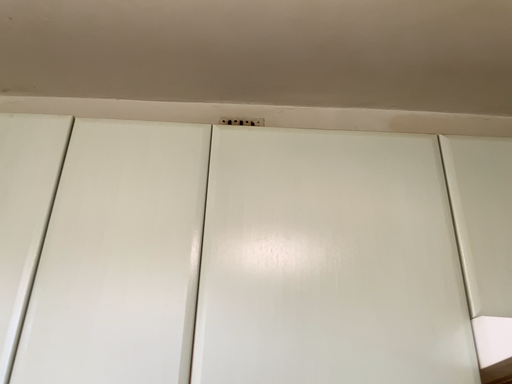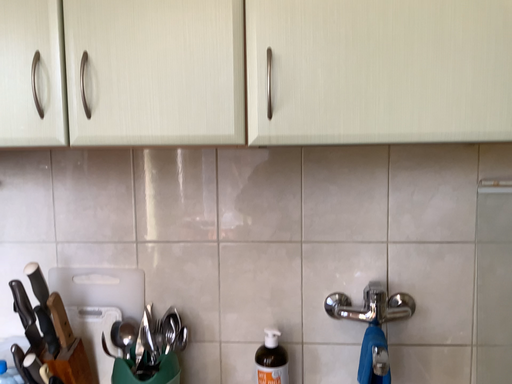
Question: How did the camera likely rotate when shooting the video?

Choices:
 (A) rotated downward
 (B) rotated upward

Answer: (A)